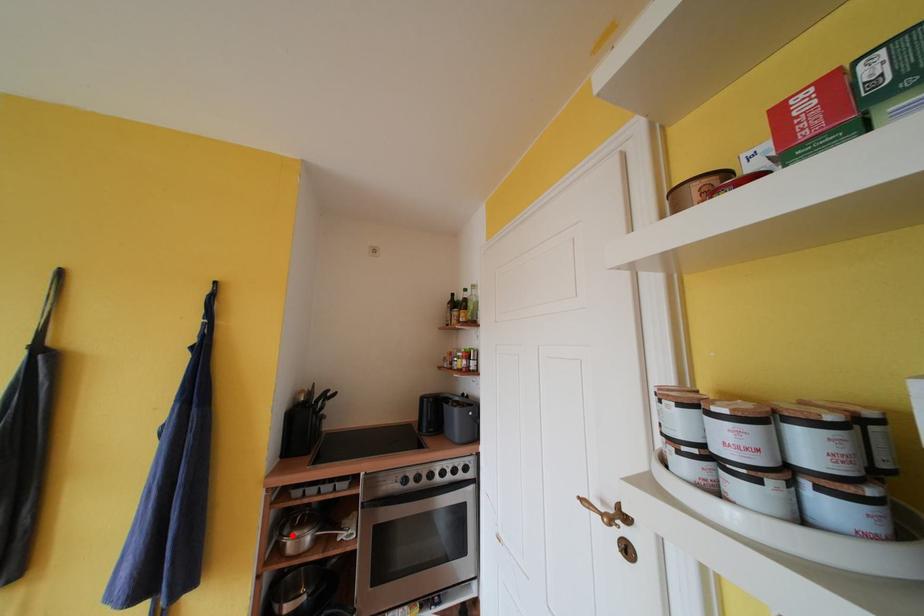
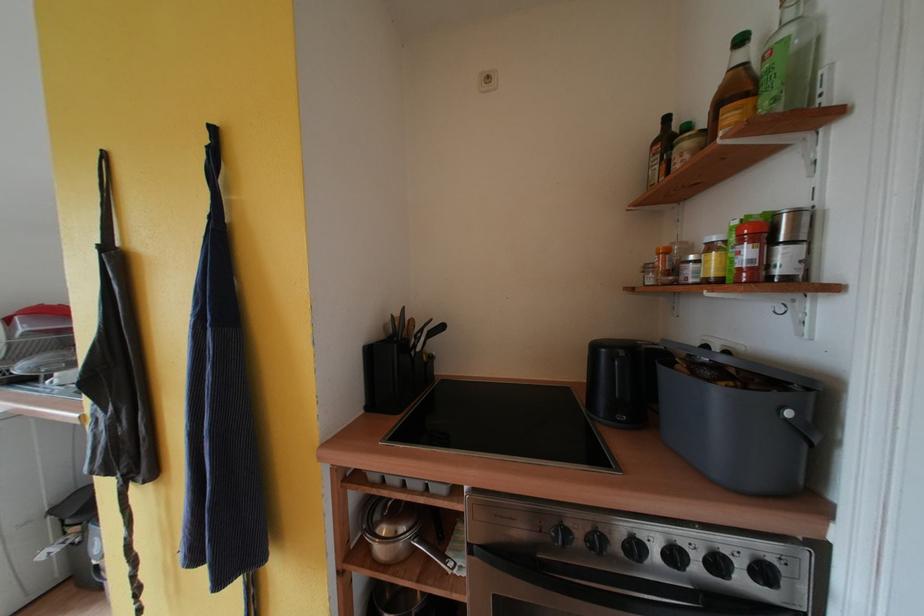
Locate, in the second image, the point that corresponds to the highlighted location in the first image.

(383, 521)